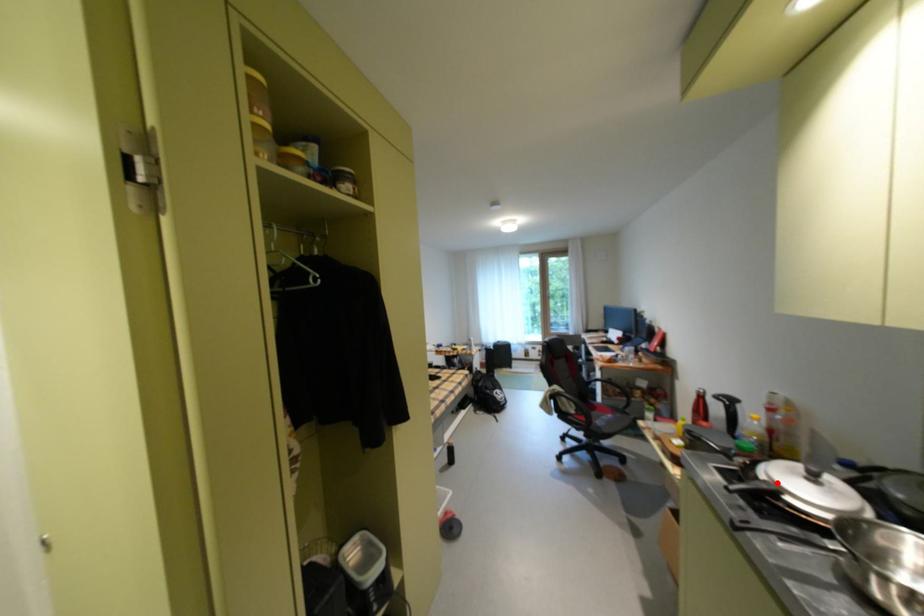
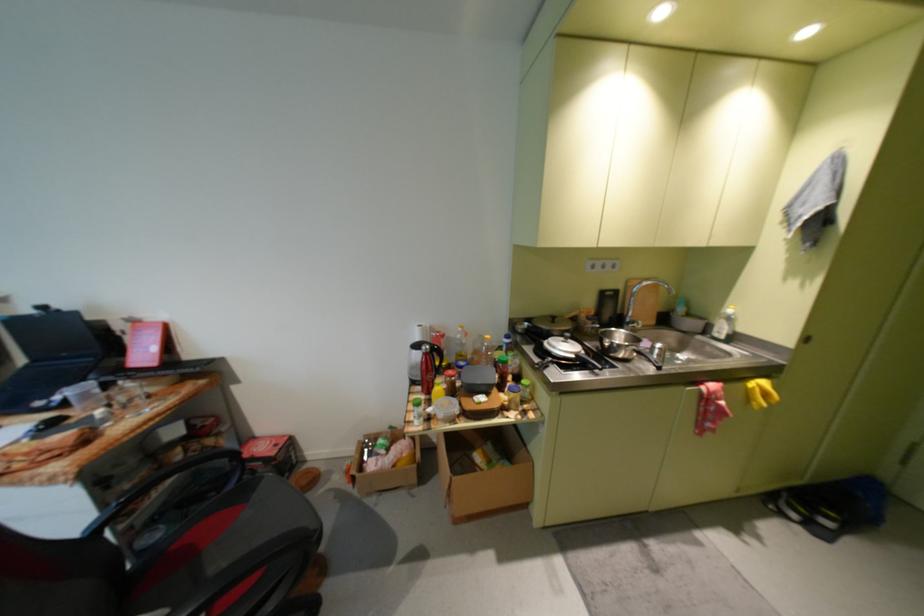
In the second image, find the point that corresponds to the highlighted location in the first image.

(586, 357)